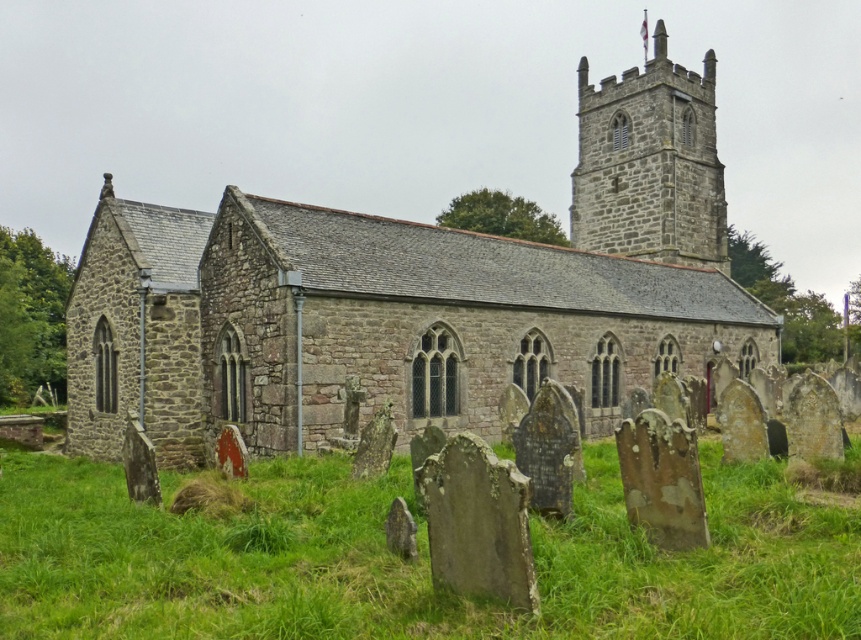
Looking at this image, you are standing at the entrance of the traditional stone church and want to place a small garden decoration. The decoration requires a spot with coordinates between 0.8 and 0.9 on the x and y axes. Is the green mossy grass at lower center suitable for placing the decoration?

The green mossy grass at lower center is located at point (406,561), which falls within the required coordinates of between 0.8 and 0.9 on both the x and y axes. Therefore, it is suitable for placing the decoration.

You are standing in a field and see the stone church at center and the green mossy grass at lower center. Which object is higher in elevation?

The stone church at center is positioned over green mossy grass at lower center, so the stone church at center is higher in elevation.

You are standing at the point marked by coordinates (x=414, y=296) in the image of the church. What structure are you currently located inside of?

The point (x=414, y=296) corresponds to the stone church at center, so you are inside the stone church at center.